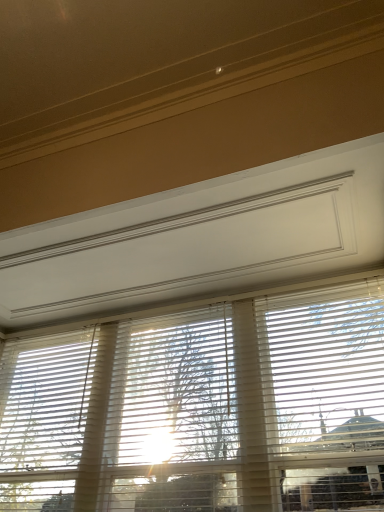
Locate an element on the screen. This screenshot has height=512, width=384. white matte blinds at center is located at coordinates (202, 407).

In the scene shown: Which is more distant, (208, 449) or (374, 432)?

The point (208, 449) is farther.

Is translucent wood tree at center far away from white matte blinds at right?

translucent wood tree at center is near white matte blinds at right, not far away.

From a real-world perspective, is translucent wood tree at center below white matte blinds at right?

No, from a real-world perspective, translucent wood tree at center is not under white matte blinds at right.

Which object is thinner, translucent wood tree at center or white matte blinds at right?

translucent wood tree at center is thinner.

Is point (224, 465) in front of point (232, 446)?

Yes, it is in front of point (232, 446).

Between white matte blinds at center and translucent wood tree at center, which one has more height?

Standing taller between the two is white matte blinds at center.

Image resolution: width=384 pixels, height=512 pixels. In order to click on window blind on the left of translucent wood tree at center in this screenshot , I will do `click(202, 407)`.

Considering the relative positions of translucent wood tree at center and white matte blinds at center in the image provided, is translucent wood tree at center to the right of white matte blinds at center from the viewer's perspective?

Indeed, translucent wood tree at center is positioned on the right side of white matte blinds at center.

Considering the sizes of translucent wood tree at center and white matte blinds at center in the image, is translucent wood tree at center taller or shorter than white matte blinds at center?

In the image, translucent wood tree at center appears to be shorter than white matte blinds at center.

From the image's perspective, is translucent wood tree at center over white matte blinds at center?

Yes.

Is white matte blinds at right positioned before translucent wood tree at center?

Yes, white matte blinds at right is closer to the camera.

From a real-world perspective, is white matte blinds at right physically below translucent wood tree at center?

Yes, from a real-world perspective, white matte blinds at right is beneath translucent wood tree at center.

Between white matte blinds at right and translucent wood tree at center, which one has smaller size?

With smaller size is translucent wood tree at center.

Which object is positioned more to the left, white matte blinds at right or translucent wood tree at center?

translucent wood tree at center.

Considering the positions of objects white matte blinds at center and white matte blinds at right in the image provided, who is more to the left, white matte blinds at center or white matte blinds at right?

Positioned to the left is white matte blinds at center.

Identify the location of blind on the right of white matte blinds at center. The image size is (384, 512). coord(324,367).

Is white matte blinds at center in front of or behind white matte blinds at right in the image?

Clearly, white matte blinds at center is in front of white matte blinds at right.

From their relative heights in the image, would you say white matte blinds at center is taller or shorter than white matte blinds at right?

Clearly, white matte blinds at center is taller compared to white matte blinds at right.

Is white matte blinds at right not near white matte blinds at center?

That's not correct — white matte blinds at right is a little close to white matte blinds at center.

Is point (382, 423) positioned in front of point (45, 443)?

Yes, point (382, 423) is in front of point (45, 443).

Do you think white matte blinds at right is within white matte blinds at center, or outside of it?

white matte blinds at right lies within the bounds of white matte blinds at center.

From the image's perspective, would you say white matte blinds at right is positioned over white matte blinds at center?

Yes, from the image's perspective, white matte blinds at right is on top of white matte blinds at center.

This screenshot has height=512, width=384. I want to click on blind that appears below the translucent wood tree at center (from a real-world perspective), so click(x=324, y=367).

Identify the location of tree to the right of white matte blinds at center. This screenshot has width=384, height=512. (179, 393).

Based on their spatial positions, is white matte blinds at center or translucent wood tree at center further from white matte blinds at right?

translucent wood tree at center.

Considering their positions, is white matte blinds at right positioned further to translucent wood tree at center than white matte blinds at center?

Based on the image, white matte blinds at right appears to be further to translucent wood tree at center.

Considering their positions, is white matte blinds at center positioned closer to translucent wood tree at center than white matte blinds at right?

white matte blinds at center.

Looking at the image, which one is located further to white matte blinds at center, translucent wood tree at center or white matte blinds at right?

white matte blinds at right lies further to white matte blinds at center than the other object.

Based on their spatial positions, is white matte blinds at right or translucent wood tree at center further from white matte blinds at center?

white matte blinds at right lies further to white matte blinds at center than the other object.

Considering their positions, is translucent wood tree at center positioned closer to white matte blinds at right than white matte blinds at center?

white matte blinds at center is closer to white matte blinds at right.

What are the coordinates of `tree between white matte blinds at center and white matte blinds at right from left to right` in the screenshot? It's located at pos(179,393).